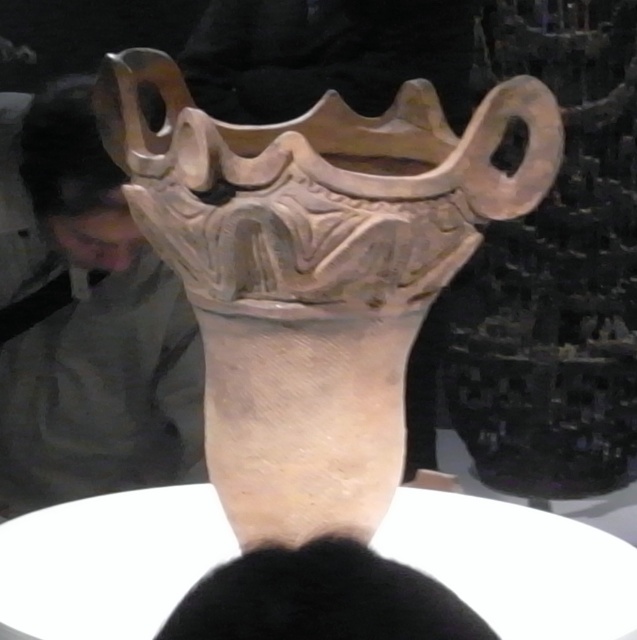
You are an interior designer arranging items on a shelf. You have a matte clay vase at center and a matte gray sculpture at upper left. Based on their sizes, which item should you place on the wider shelf space to ensure it fits properly?

The matte clay vase at center has a greater width than the matte gray sculpture at upper left, so it should be placed on the wider shelf space to ensure it fits properly.

You are an interior designer trying to place a new lamp between the matte clay vase at center and the matte gray sculpture at upper left. The lamp requires at least 30 inches of space to fit properly. Based on the scene, will there be enough space between the two objects to accommodate the lamp?

The matte clay vase at center is 34.19 inches away from the matte gray sculpture at upper left, which is more than the required 30 inches. Therefore, there is enough space to place the lamp between them.

You are an art curator arranging items in a gallery. You have a matte clay vase at center and a matte gray sculpture at upper left. Based on their positions, which object is closer to the left edge of the display area?

The matte gray sculpture at upper left is closer to the left edge of the display area because it is positioned to the left of the matte clay vase at center.